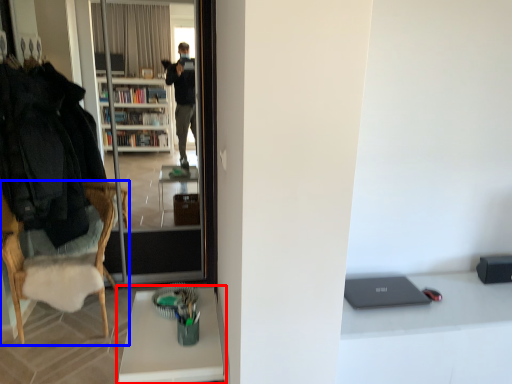
Question: Among these objects, which one is farthest to the camera, desk (highlighted by a red box) or chair (highlighted by a blue box)?

Choices:
 (A) desk
 (B) chair

Answer: (B)